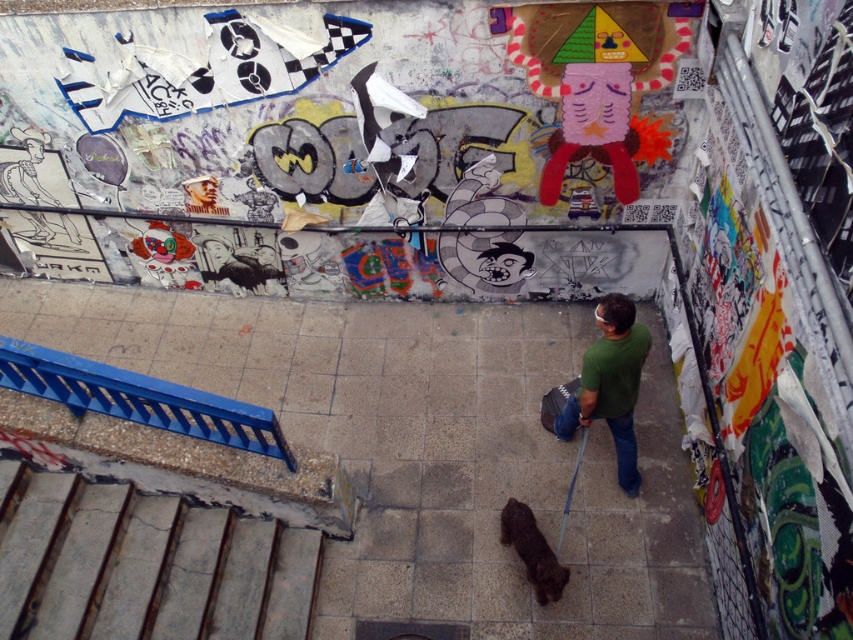
You are a pedestrian standing at the entrance of the alleyway. You see a point marked as point (610,384) in the scene. What object does this point correspond to?

The point (610,384) corresponds to the green matte shirt at center.

You are a photographer trying to capture the dog and its leash in the alleyway. Since the shiny brown fur at center and the blue fabric leash at lower center are both in your view, which one should you focus on to ensure the dog is clearly visible in the photo?

The shiny brown fur at center should be focused on because it is in front of the blue fabric leash at lower center, making it the primary subject closer to the camera.

You are a photographer trying to capture the scene of the man and his dog in the alleyway. You notice the shiny brown fur at center and the blue fabric leash at lower center. Which object is closer to the ground?

The shiny brown fur at center is shorter than the blue fabric leash at lower center, so the shiny brown fur at center is closer to the ground.